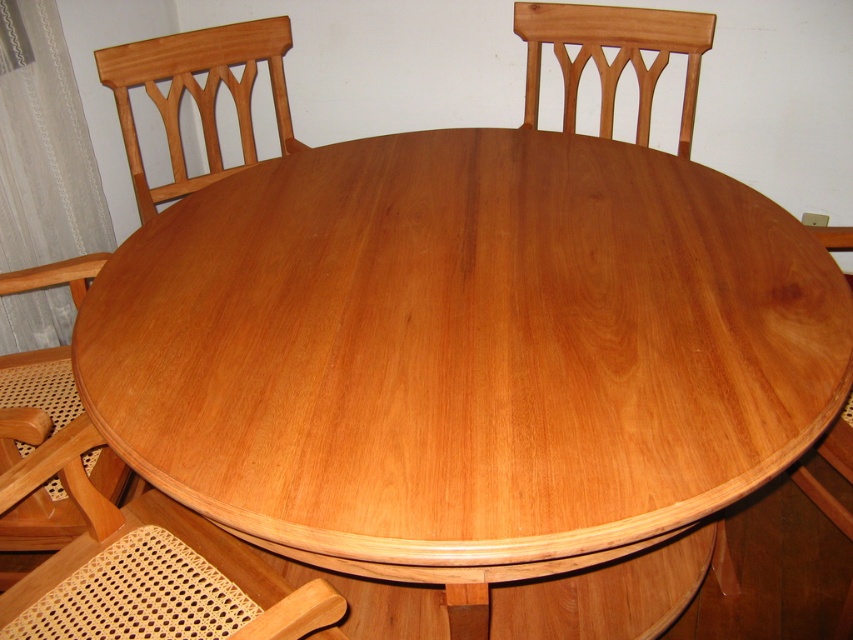
Question: Among these objects, which one is farthest from the camera?

Choices:
 (A) light brown woven cane at lower left
 (B) light brown wood chair at lower right

Answer: (B)

Question: Among these objects, which one is nearest to the camera?

Choices:
 (A) light brown wood chair at upper left
 (B) light brown woven cane at lower left
 (C) light brown wood table at center
 (D) light brown wood chair at lower right

Answer: (B)

Question: Is light brown wood chair at upper left to the right of light brown wood chair at lower right from the viewer's perspective?

Choices:
 (A) yes
 (B) no

Answer: (B)

Question: Where is light brown woven cane at lower left located in relation to light brown wood chair at upper left in the image?

Choices:
 (A) below
 (B) above

Answer: (A)

Question: Can you confirm if light brown wood chair at upper left is positioned above light brown wood chair at lower left?

Choices:
 (A) no
 (B) yes

Answer: (B)

Question: Which of the following is the closest to the observer?

Choices:
 (A) light brown wood table at center
 (B) light brown wood chair at upper left
 (C) light brown wood chair at lower right

Answer: (A)